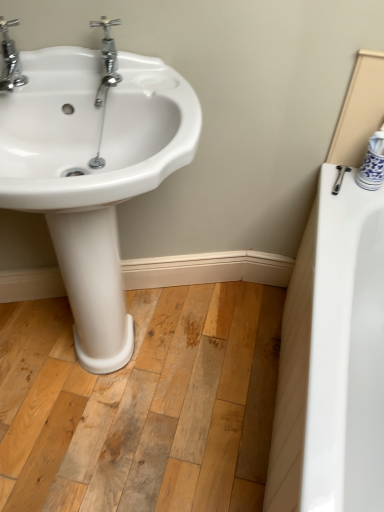
Question: Is the position of white glossy sink at left more distant than that of chrome metallic faucet at upper left, the 1th tap from the left?

Choices:
 (A) yes
 (B) no

Answer: (B)

Question: From a real-world perspective, is white glossy sink at left below chrome metallic faucet at upper left, the 1th tap from the left?

Choices:
 (A) no
 (B) yes

Answer: (B)

Question: From the image's perspective, would you say white glossy sink at left is shown under chrome metallic faucet at upper left, the 1th tap from the left?

Choices:
 (A) no
 (B) yes

Answer: (B)

Question: Is white glossy sink at left to the left of chrome metallic faucet at upper left, the second tap when ordered from right to left, from the viewer's perspective?

Choices:
 (A) yes
 (B) no

Answer: (B)

Question: Can you confirm if white glossy sink at left is bigger than chrome metallic faucet at upper left, the second tap when ordered from right to left?

Choices:
 (A) no
 (B) yes

Answer: (B)

Question: From a real-world perspective, is white glossy sink at left positioned over chrome metallic faucet at upper left, the second tap when ordered from right to left, based on gravity?

Choices:
 (A) yes
 (B) no

Answer: (B)

Question: Can you confirm if chrome/metallic faucet at upper left, arranged as the first tap when viewed from the right, is bigger than chrome metallic faucet at upper left, the 1th tap from the left?

Choices:
 (A) no
 (B) yes

Answer: (A)

Question: From a real-world perspective, is chrome/metallic faucet at upper left, the 2th tap in the left-to-right sequence, over chrome metallic faucet at upper left, the 1th tap from the left?

Choices:
 (A) no
 (B) yes

Answer: (A)

Question: Does chrome/metallic faucet at upper left, arranged as the first tap when viewed from the right, have a greater width compared to chrome metallic faucet at upper left, the second tap when ordered from right to left?

Choices:
 (A) no
 (B) yes

Answer: (A)

Question: Is chrome/metallic faucet at upper left, arranged as the first tap when viewed from the right, positioned with its back to chrome metallic faucet at upper left, the second tap when ordered from right to left?

Choices:
 (A) no
 (B) yes

Answer: (A)

Question: Is chrome/metallic faucet at upper left, arranged as the first tap when viewed from the right, smaller than chrome metallic faucet at upper left, the second tap when ordered from right to left?

Choices:
 (A) no
 (B) yes

Answer: (B)

Question: Is chrome/metallic faucet at upper left, arranged as the first tap when viewed from the right, closer to camera compared to chrome metallic faucet at upper left, the second tap when ordered from right to left?

Choices:
 (A) yes
 (B) no

Answer: (B)

Question: Is chrome/metallic faucet at upper left, the 2th tap in the left-to-right sequence, looking in the opposite direction of white glossy sink at left?

Choices:
 (A) no
 (B) yes

Answer: (A)